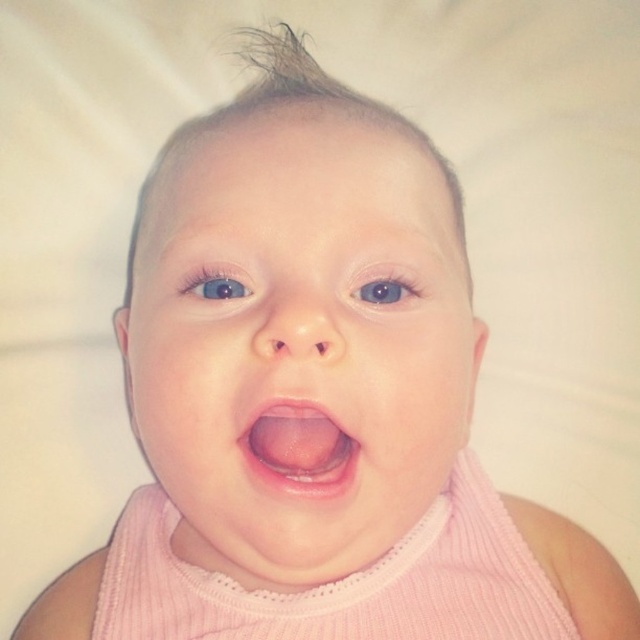
Question: Which point appears closest to the camera in this image?

Choices:
 (A) (467, 296)
 (B) (256, 442)

Answer: (B)

Question: Is smooth pink baby at center bigger than pink glossy tongue at center?

Choices:
 (A) yes
 (B) no

Answer: (A)

Question: Does smooth pink baby at center appear on the left side of pink glossy tongue at center?

Choices:
 (A) no
 (B) yes

Answer: (B)

Question: In this image, where is smooth pink baby at center located relative to pink glossy tongue at center?

Choices:
 (A) below
 (B) above

Answer: (B)

Question: Which object appears farthest from the camera in this image?

Choices:
 (A) pink glossy tongue at center
 (B) smooth pink baby at center

Answer: (A)